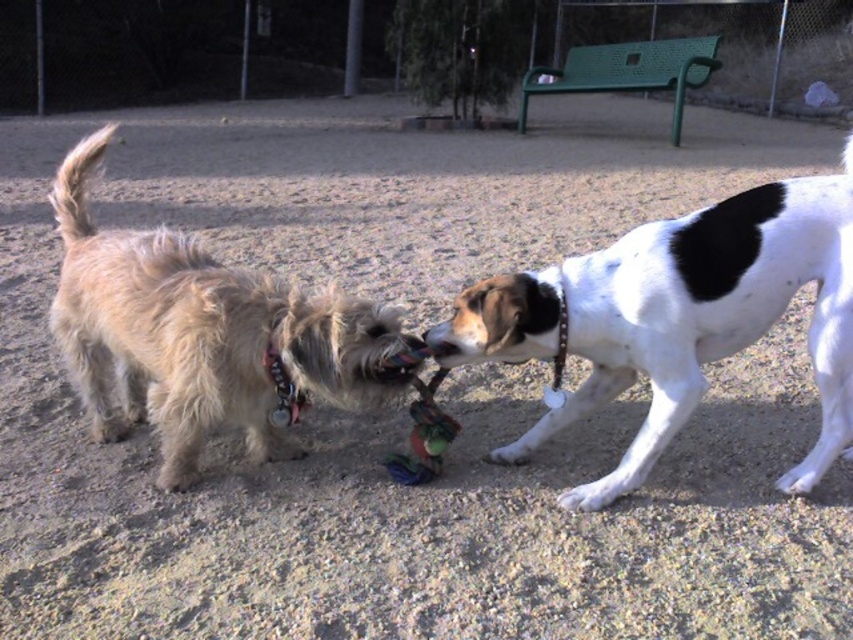
You are a dog owner who wants to ensure there is enough space for your new dog to play without feeling cramped. You see the white smooth dog at right and the light brown fur at left in the park. Which dog takes up more space in the image?

The light brown fur at left takes up more space than the white smooth dog at right.

You are a dog owner who wants to separate your two dogs during their playtime. The minimum distance required for a safe separation is 30 inches. Can you safely separate the white smooth dog at right and the light brown fur at left using a divider?

The white smooth dog at right is 35.22 inches away from the light brown fur at left. Since the required minimum distance is 30 inches, the dogs are already separated by more than the required distance. Therefore, you can safely use a divider to separate them without needing to adjust their positions.

You are a dog owner who wants to separate the two dogs during their tug of war. The park has a divider that can only be placed between the white smooth dog at right and the light brown fur at left. Based on their positions, will the divider work effectively?

The white smooth dog at right is below the light brown fur at left, so placing the divider between them may not be effective as they are positioned vertically rather than horizontally. The divider might not separate them properly.